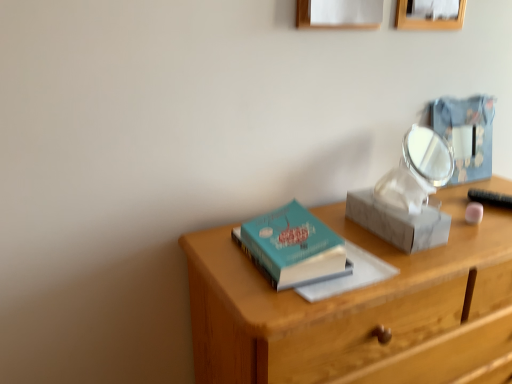
Identify the location of vacant space in front of teal matte hardcover book at center. This screenshot has height=384, width=512. (285, 298).